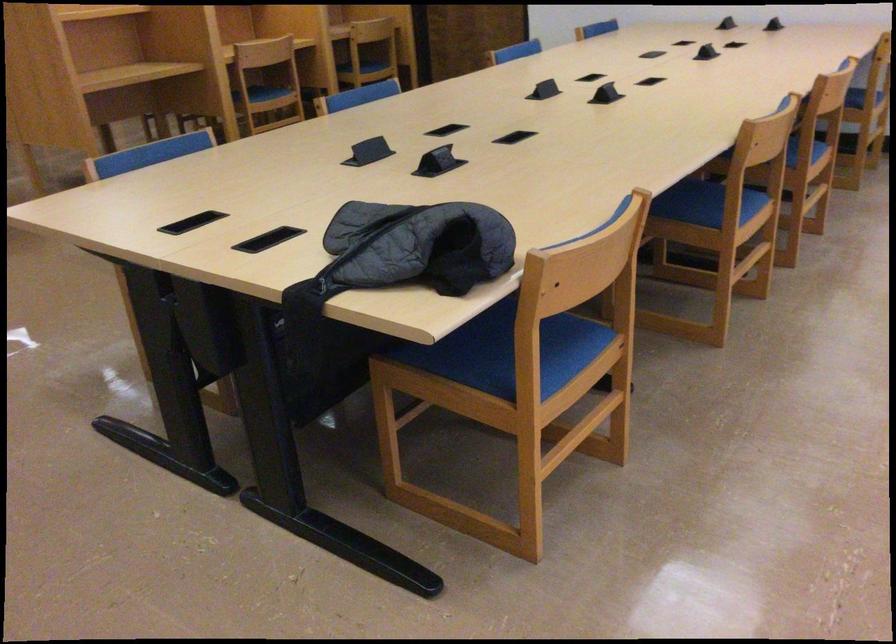
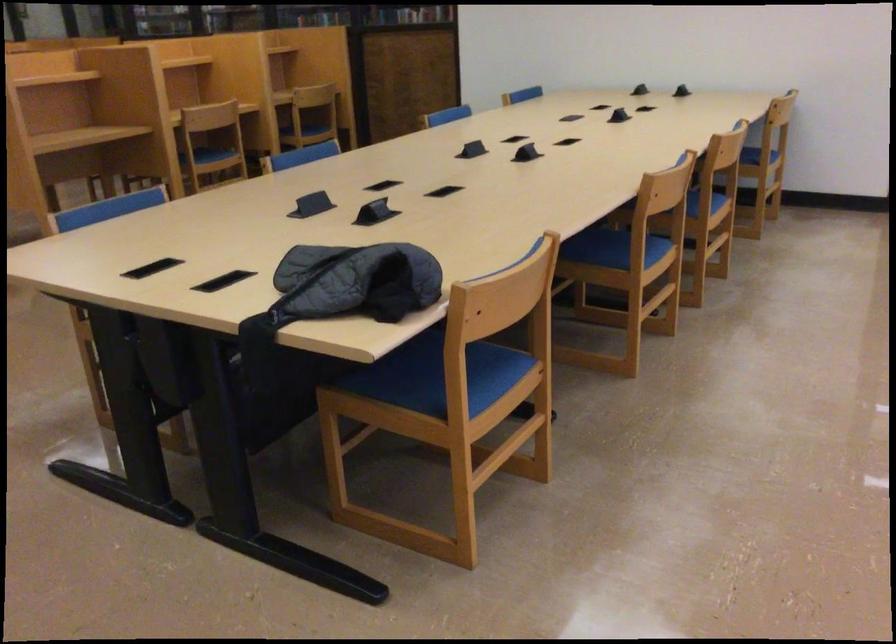
Question: The first image is from the beginning of the video and the second image is from the end. How did the camera likely rotate when shooting the video?

Choices:
 (A) Left
 (B) Right
 (C) Up
 (D) Down

Answer: (B)